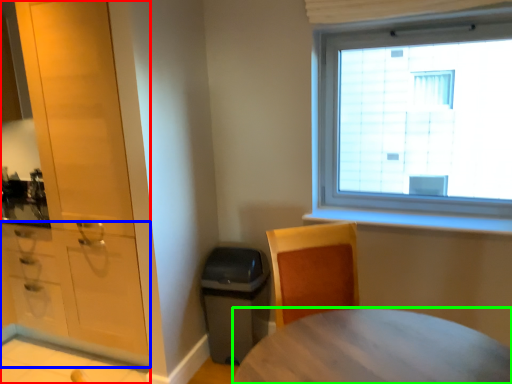
Question: Which object is the closest to the cabinetry (highlighted by a red box)? Choose among these: cabinetry (highlighted by a blue box) or desk (highlighted by a green box).

Choices:
 (A) cabinetry
 (B) desk

Answer: (A)